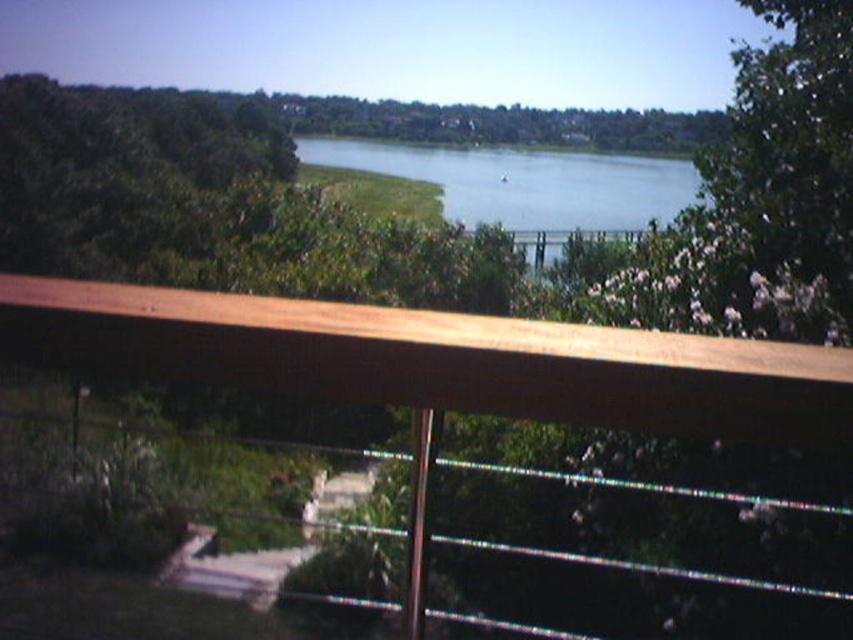
Question: Which object appears closest to the camera in this image?

Choices:
 (A) blue water at center
 (B) wooden railing at upper center

Answer: (B)

Question: Which point appears closest to the camera in this image?

Choices:
 (A) (277, 365)
 (B) (500, 182)

Answer: (A)

Question: Is wooden railing at upper center to the left of blue water at center from the viewer's perspective?

Choices:
 (A) yes
 (B) no

Answer: (A)

Question: Is wooden railing at upper center above blue water at center?

Choices:
 (A) no
 (B) yes

Answer: (A)

Question: Considering the relative positions of wooden railing at upper center and blue water at center in the image provided, where is wooden railing at upper center located with respect to blue water at center?

Choices:
 (A) left
 (B) right

Answer: (A)